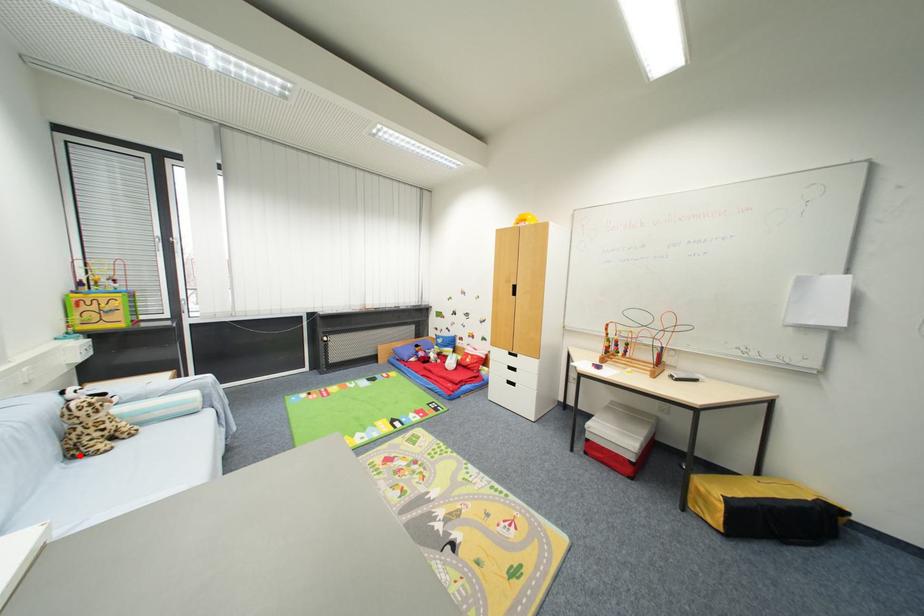
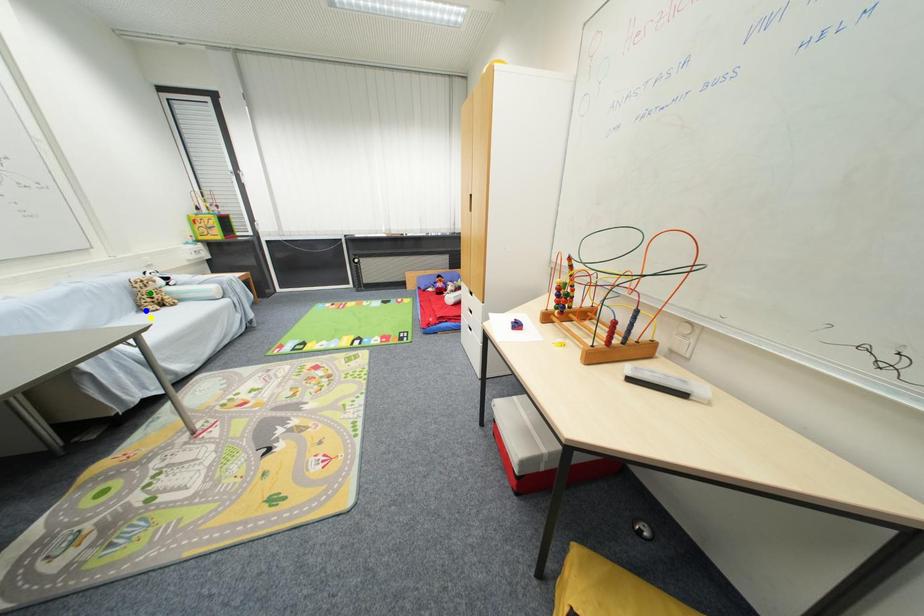
Question: I am providing you with two images of the same scene from different viewpoints. A red point is marked on the first image. You are given multiple points on the second image. In image 2, which mark is for the same physical point as the one in image 1?

Choices:
 (A) blue point
 (B) green point
 (C) yellow point

Answer: (A)